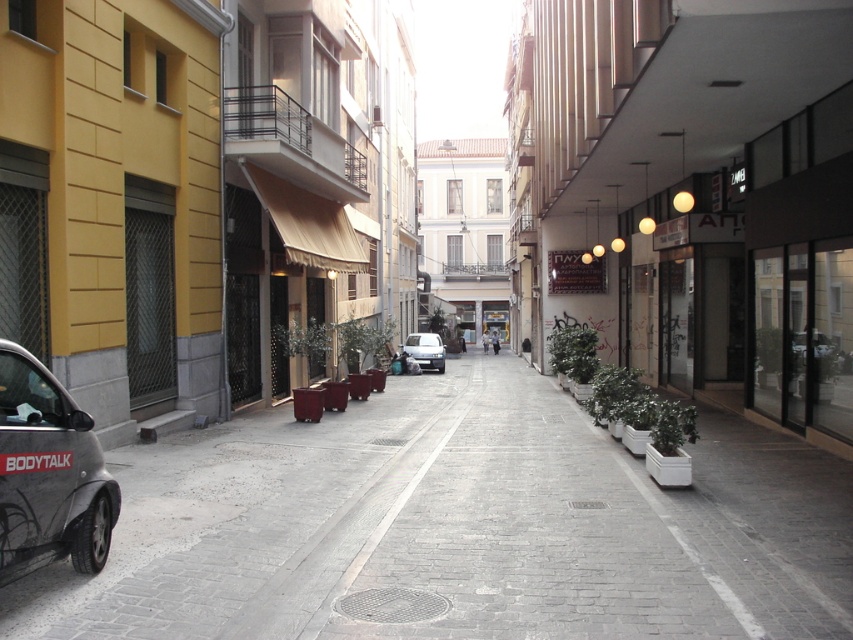
Question: Can you confirm if gray concrete pavement at center is positioned to the right of white matte van at center?

Choices:
 (A) no
 (B) yes

Answer: (B)

Question: Which point is farther to the camera?

Choices:
 (A) (410, 346)
 (B) (67, 518)
 (C) (468, 628)

Answer: (A)

Question: Does matte black car at left have a larger size compared to white matte van at center?

Choices:
 (A) yes
 (B) no

Answer: (B)

Question: Can you confirm if matte black car at left is positioned above white matte van at center?

Choices:
 (A) yes
 (B) no

Answer: (B)

Question: Which point is closer to the camera?

Choices:
 (A) matte black car at left
 (B) white matte van at center
 (C) gray concrete pavement at center

Answer: (A)

Question: Which object appears farthest from the camera in this image?

Choices:
 (A) matte black car at left
 (B) white matte van at center

Answer: (B)